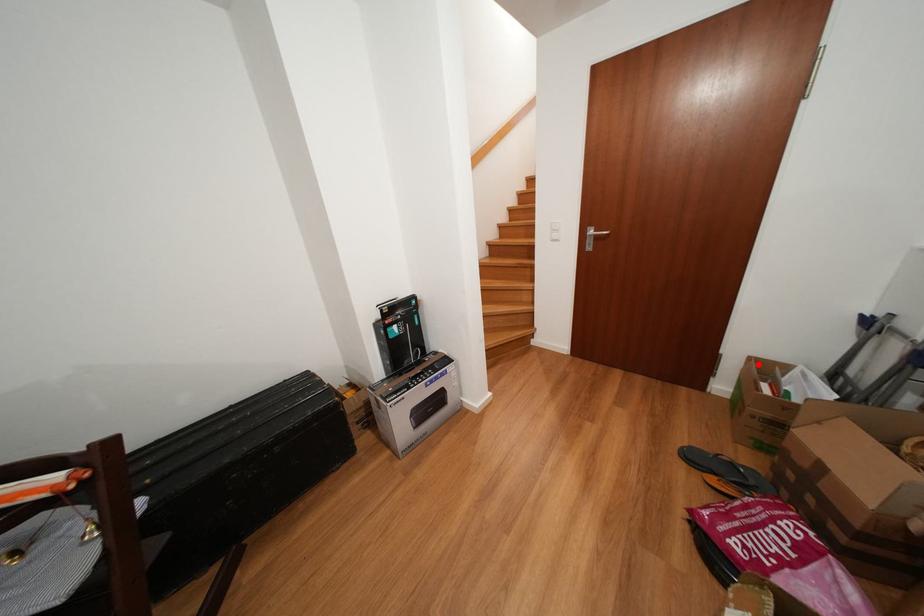
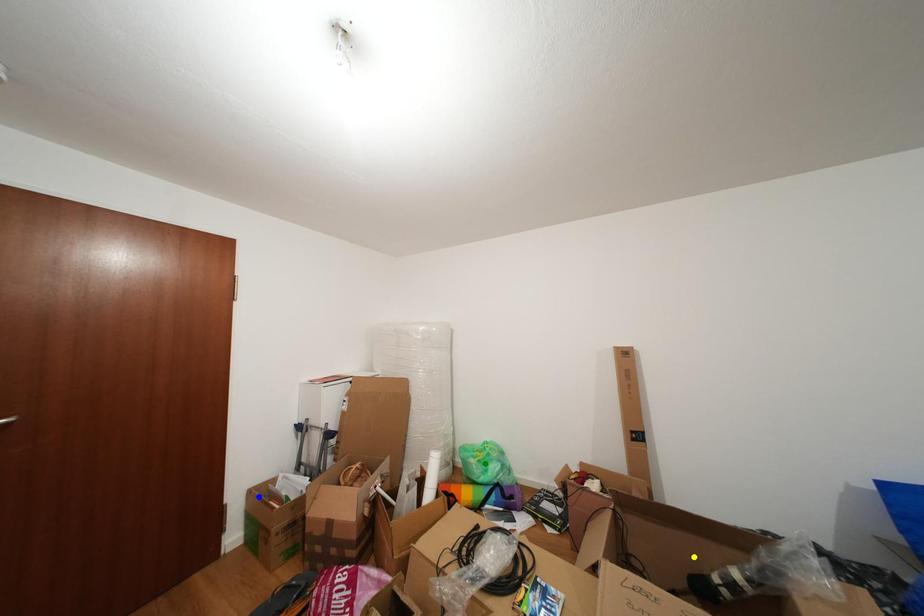
Question: I am providing you with two images of the same scene from different viewpoints. A red point is marked on the first image. You are given multiple points on the second image. Can you choose the point in image 2 that corresponds to the point in image 1?

Choices:
 (A) blue point
 (B) yellow point
 (C) green point

Answer: (A)